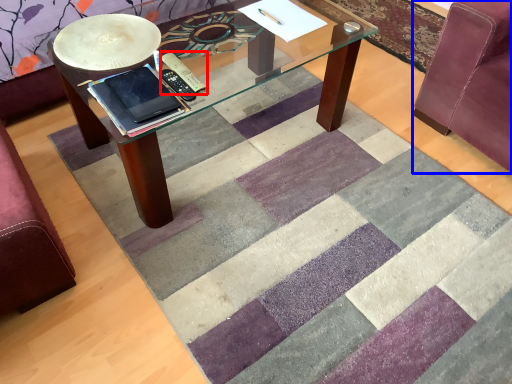
Question: Which object is closer to the camera taking this photo, remote (highlighted by a red box) or swivel chair (highlighted by a blue box)?

Choices:
 (A) remote
 (B) swivel chair

Answer: (B)